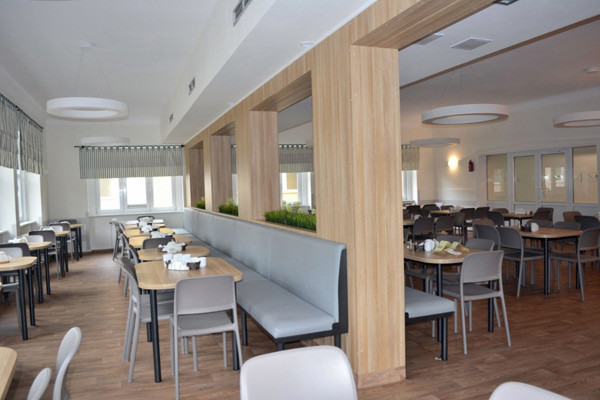
Locate an element on the screen. tan colored pillars is located at coordinates (192, 179), (216, 178), (253, 175), (347, 200).